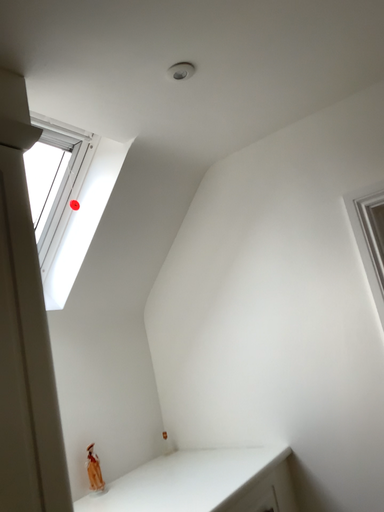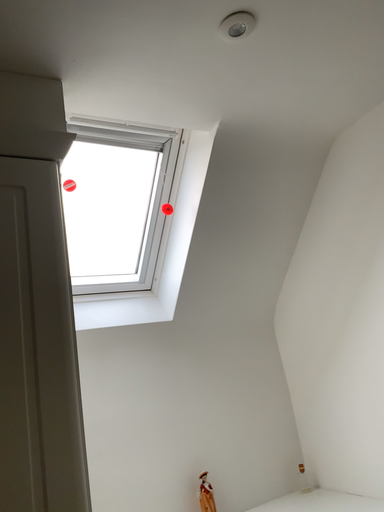
Question: How did the camera likely rotate when shooting the video?

Choices:
 (A) rotated left
 (B) rotated right

Answer: (A)